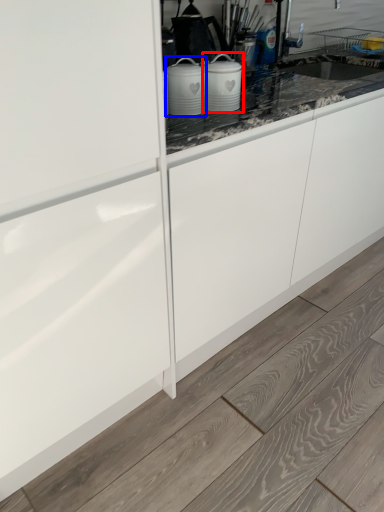
Question: Which point is further to the camera, kitchen appliance (highlighted by a red box) or home appliance (highlighted by a blue box)?

Choices:
 (A) kitchen appliance
 (B) home appliance

Answer: (A)